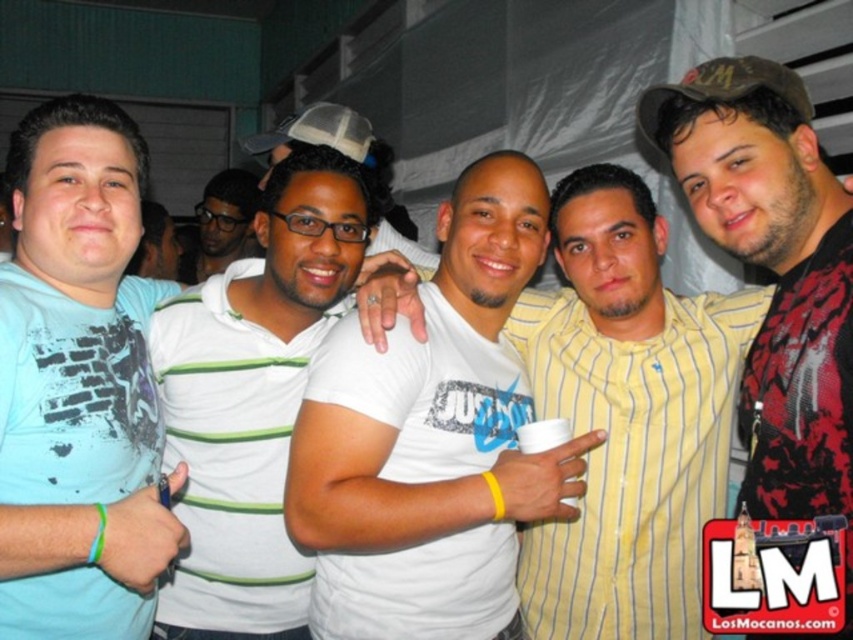
Image resolution: width=853 pixels, height=640 pixels. What do you see at coordinates (252, 403) in the screenshot?
I see `white striped shirt at center` at bounding box center [252, 403].

Can you confirm if white striped shirt at center is wider than brown fabric baseball cap at upper right?

Indeed, white striped shirt at center has a greater width compared to brown fabric baseball cap at upper right.

Is point (329, 232) closer to camera compared to point (730, 64)?

No, it is behind (730, 64).

What are the coordinates of `white striped shirt at center` in the screenshot? It's located at (252, 403).

Is white cotton t-shirt at center taller than light blue t-shirt at left?

Yes.

How distant is white cotton t-shirt at center from light blue t-shirt at left?

A distance of 41.38 centimeters exists between white cotton t-shirt at center and light blue t-shirt at left.

Does point (439, 616) come closer to viewer compared to point (16, 461)?

No, it is not.

Locate an element on the screen. The image size is (853, 640). white cotton t-shirt at center is located at coordinates (431, 438).

Is white cotton t-shirt at center positioned before brown fabric baseball cap at upper right?

No, white cotton t-shirt at center is further to the viewer.

What do you see at coordinates (431, 438) in the screenshot?
I see `white cotton t-shirt at center` at bounding box center [431, 438].

Is point (451, 310) more distant than point (646, 124)?

Yes.

Locate an element on the screen. The width and height of the screenshot is (853, 640). white cotton t-shirt at center is located at coordinates (431, 438).